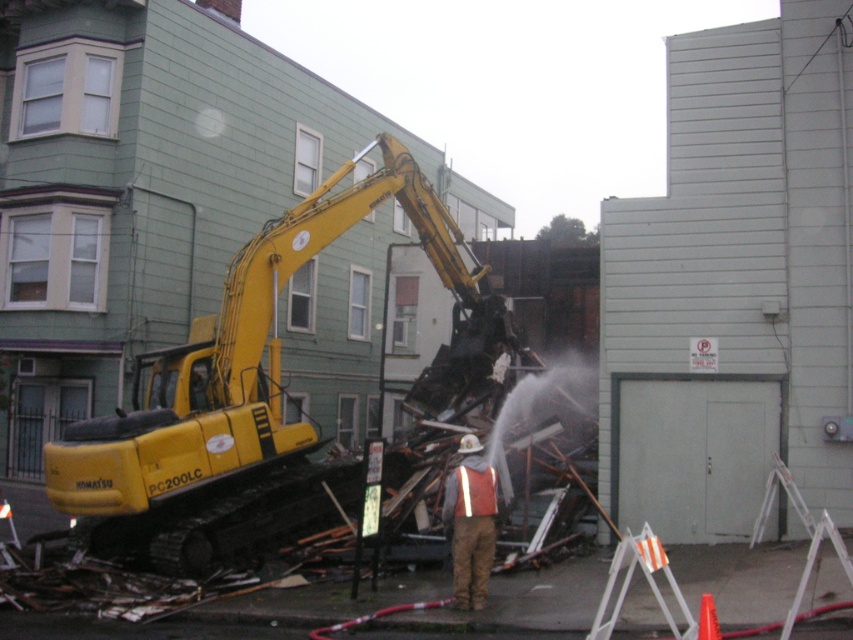
Question: Does yellow tracked excavator at left have a larger size compared to firefighter uniform at center?

Choices:
 (A) no
 (B) yes

Answer: (B)

Question: Which point is closer to the camera?

Choices:
 (A) yellow tracked excavator at left
 (B) firefighter uniform at center

Answer: (B)

Question: Can you confirm if yellow tracked excavator at left is wider than firefighter uniform at center?

Choices:
 (A) no
 (B) yes

Answer: (B)

Question: Is yellow tracked excavator at left positioned behind firefighter uniform at center?

Choices:
 (A) no
 (B) yes

Answer: (B)

Question: Which point is farther to the camera?

Choices:
 (A) (480, 577)
 (B) (96, 448)

Answer: (B)